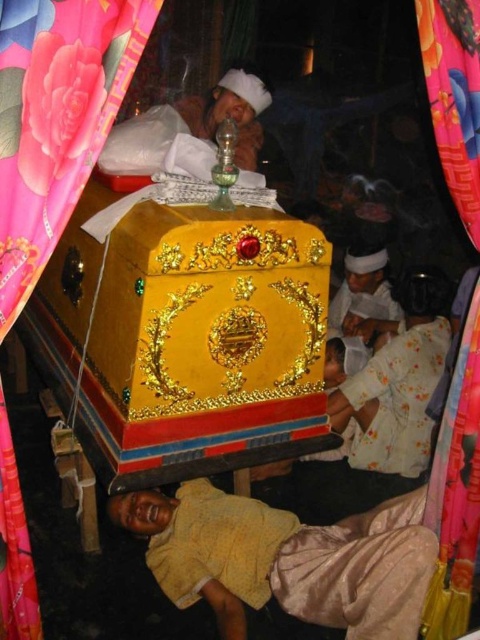
Which is below, yellow fabric at lower center or floral cotton robe at lower right?

Positioned lower is yellow fabric at lower center.

Is yellow fabric at lower center to the left of floral cotton robe at lower right from the viewer's perspective?

Yes, yellow fabric at lower center is to the left of floral cotton robe at lower right.

Between point (384, 595) and point (388, 362), which one is positioned behind?

Point (388, 362)

The width and height of the screenshot is (480, 640). I want to click on yellow fabric at lower center, so click(286, 560).

Looking at this image, does floral cotton robe at lower right have a lesser height compared to pink satin curtain at upper left?

No, floral cotton robe at lower right is not shorter than pink satin curtain at upper left.

Is floral cotton robe at lower right to the left of pink satin curtain at upper left from the viewer's perspective?

In fact, floral cotton robe at lower right is to the right of pink satin curtain at upper left.

Measure the distance between point (x=399, y=369) and camera.

They are 10.38 feet apart.

Where is `floral cotton robe at lower right`? floral cotton robe at lower right is located at coordinates (397, 400).

Does yellow fabric at lower center appear over pink satin curtain at upper left?

Actually, yellow fabric at lower center is below pink satin curtain at upper left.

Between yellow fabric at lower center and pink satin curtain at upper left, which one appears on the left side from the viewer's perspective?

yellow fabric at lower center is more to the left.

Locate an element on the screen. The height and width of the screenshot is (640, 480). yellow fabric at lower center is located at coordinates (286, 560).